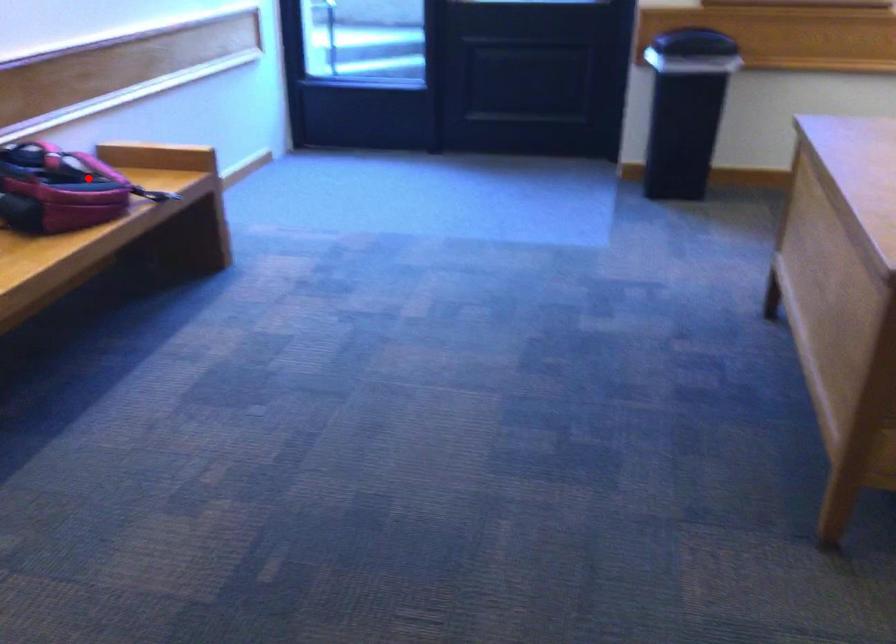
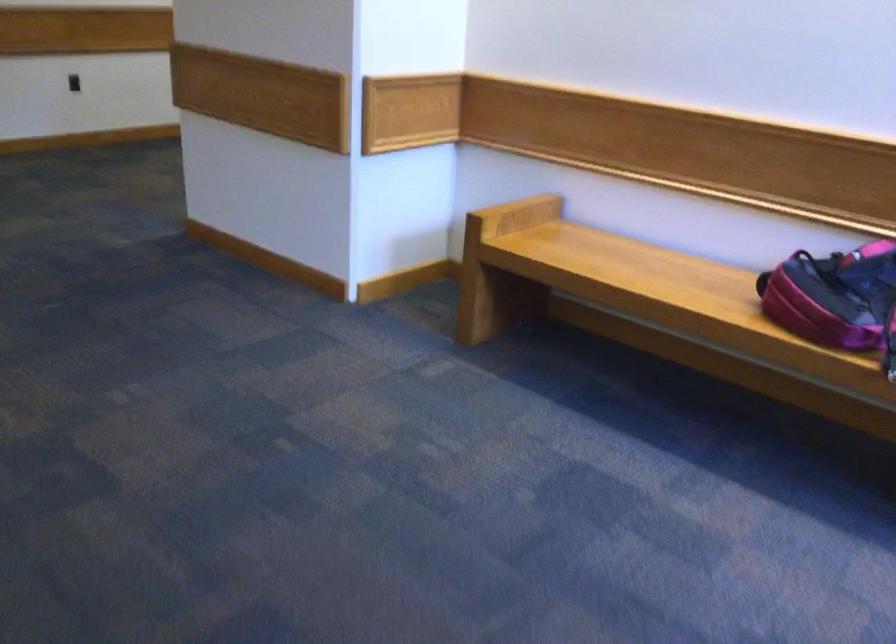
The point at the highlighted location is marked in the first image. Where is the corresponding point in the second image?

(833, 296)